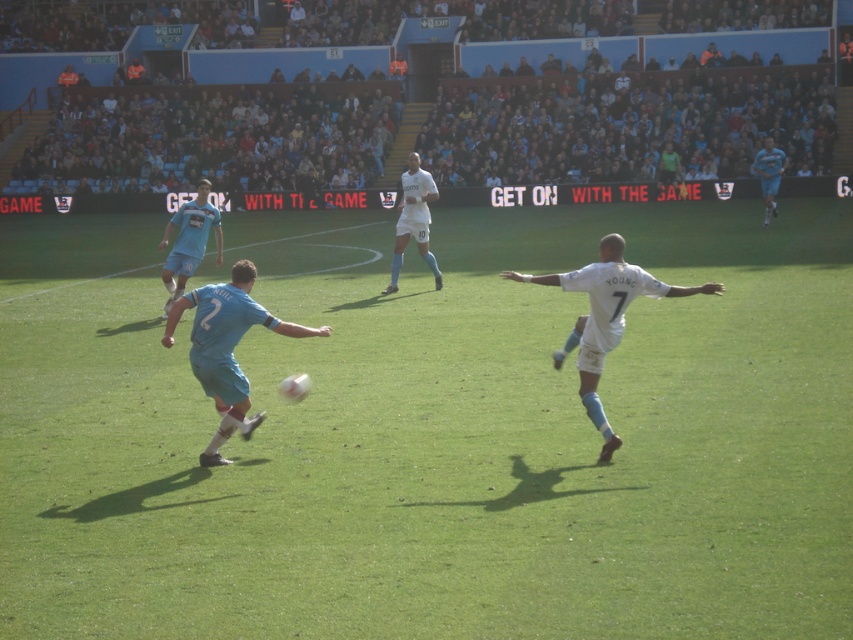
What do you see at coordinates (225, 348) in the screenshot?
I see `matte blue jersey at center` at bounding box center [225, 348].

Which of these two, matte blue jersey at center or light blue jersey at upper right, stands shorter?

matte blue jersey at center

This screenshot has height=640, width=853. What do you see at coordinates (225, 348) in the screenshot?
I see `matte blue jersey at center` at bounding box center [225, 348].

Where is `matte blue jersey at center`? matte blue jersey at center is located at coordinates 225,348.

Can you confirm if white matte jersey at center is positioned to the right of light blue jersey at center?

Yes, white matte jersey at center is to the right of light blue jersey at center.

Is white matte jersey at center thinner than light blue jersey at center?

Indeed, white matte jersey at center has a lesser width compared to light blue jersey at center.

Find the location of a particular element. The image size is (853, 640). white matte jersey at center is located at coordinates (604, 317).

Does light blue jersey at center appear over white matte soccer player at center?

Actually, light blue jersey at center is below white matte soccer player at center.

Looking at this image, does light blue jersey at center have a greater width compared to white matte soccer player at center?

Yes, light blue jersey at center is wider than white matte soccer player at center.

Does point (178, 252) come closer to viewer compared to point (416, 209)?

That is True.

Locate an element on the screen. The width and height of the screenshot is (853, 640). light blue jersey at center is located at coordinates 189,241.